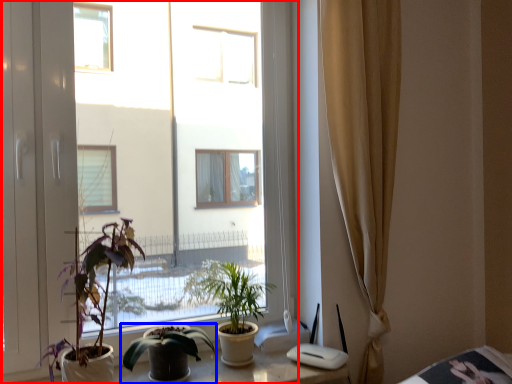
Question: Which object is further to the camera taking this photo, window (highlighted by a red box) or houseplant (highlighted by a blue box)?

Choices:
 (A) window
 (B) houseplant

Answer: (B)